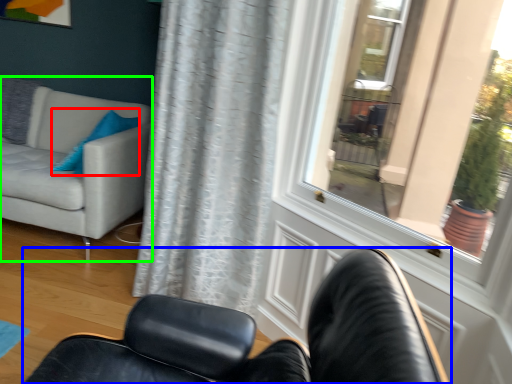
Question: Which is nearer to the pillow (highlighted by a red box)? chair (highlighted by a blue box) or studio couch (highlighted by a green box).

Choices:
 (A) chair
 (B) studio couch

Answer: (B)